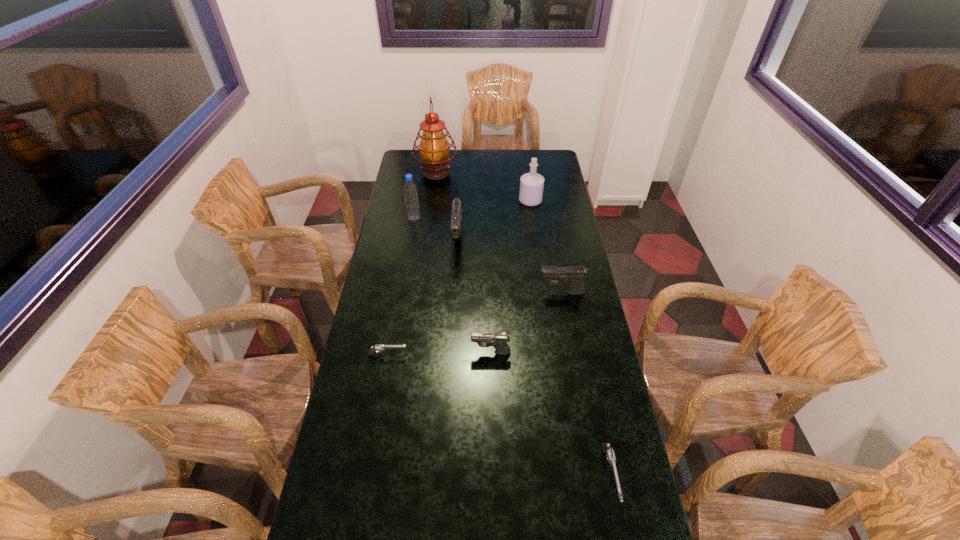
This screenshot has width=960, height=540. What are the coordinates of `the farthest object` in the screenshot? It's located at (434, 149).

This screenshot has width=960, height=540. In order to click on oil lamp in this screenshot , I will do `click(434, 149)`.

The image size is (960, 540). I want to click on the seventh nearest object, so click(531, 184).

Find the location of a particular element. The width and height of the screenshot is (960, 540). purple perfume is located at coordinates (531, 184).

Find the location of a particular element. The width and height of the screenshot is (960, 540). water bottle is located at coordinates (410, 189).

Where is `the farthest pistol`? This screenshot has width=960, height=540. the farthest pistol is located at coordinates (456, 219).

Where is `the fourth farthest object`? the fourth farthest object is located at coordinates (456, 219).

The image size is (960, 540). In order to click on the fourth nearest pistol in this screenshot , I will do `click(572, 276)`.

Where is `the second nearest black pistol`? the second nearest black pistol is located at coordinates (572, 276).

In order to click on the fourth object from right to left in this screenshot , I will do `click(498, 340)`.